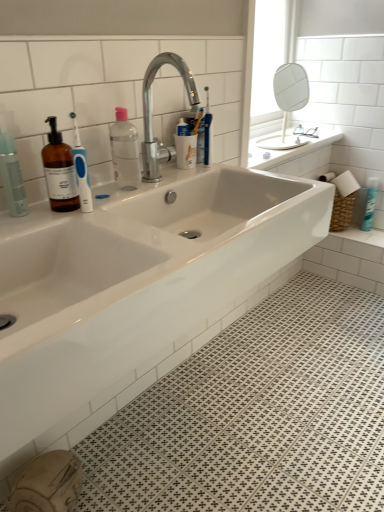
Question: Is white glossy sink at center turned away from white glossy sink at upper right?

Choices:
 (A) no
 (B) yes

Answer: (A)

Question: From a real-world perspective, is white glossy sink at center physically above white glossy sink at upper right?

Choices:
 (A) no
 (B) yes

Answer: (A)

Question: Can you confirm if white glossy sink at center is wider than white glossy sink at upper right?

Choices:
 (A) no
 (B) yes

Answer: (B)

Question: Is white glossy sink at center shorter than white glossy sink at upper right?

Choices:
 (A) yes
 (B) no

Answer: (B)

Question: Is white glossy sink at upper right inside white glossy sink at center?

Choices:
 (A) no
 (B) yes

Answer: (A)

Question: Considering the positions of white glossy spray can at upper right, marked as the first toiletry in a back-to-front arrangement, and white glossy sink at center in the image, is white glossy spray can at upper right, marked as the first toiletry in a back-to-front arrangement, taller or shorter than white glossy sink at center?

Choices:
 (A) short
 (B) tall

Answer: (A)

Question: Looking at their shapes, would you say white glossy spray can at upper right, the second toiletry in the left-to-right sequence, is wider or thinner than white glossy sink at center?

Choices:
 (A) thin
 (B) wide

Answer: (A)

Question: Does point (375, 181) appear closer or farther from the camera than point (233, 208)?

Choices:
 (A) closer
 (B) farther

Answer: (B)

Question: Relative to white glossy sink at center, is white glossy spray can at upper right, the second toiletry in the left-to-right sequence, in front or behind?

Choices:
 (A) behind
 (B) front

Answer: (A)

Question: Looking at their shapes, would you say white glossy sink at center is wider or thinner than white glossy mirror at upper right?

Choices:
 (A) wide
 (B) thin

Answer: (A)

Question: Is white glossy sink at center bigger or smaller than white glossy mirror at upper right?

Choices:
 (A) small
 (B) big

Answer: (B)

Question: Considering the positions of white glossy sink at center and white glossy mirror at upper right in the image, is white glossy sink at center taller or shorter than white glossy mirror at upper right?

Choices:
 (A) tall
 (B) short

Answer: (A)

Question: Is white glossy sink at center inside the boundaries of white glossy mirror at upper right, or outside?

Choices:
 (A) inside
 (B) outside

Answer: (B)

Question: Considering the positions of point (150, 87) and point (370, 221), is point (150, 87) closer or farther from the camera than point (370, 221)?

Choices:
 (A) closer
 (B) farther

Answer: (A)

Question: From the image's perspective, relative to white glossy spray can at upper right, the first toiletry viewed from the right, is chrome metallic faucet at upper center above or below?

Choices:
 (A) below
 (B) above

Answer: (B)